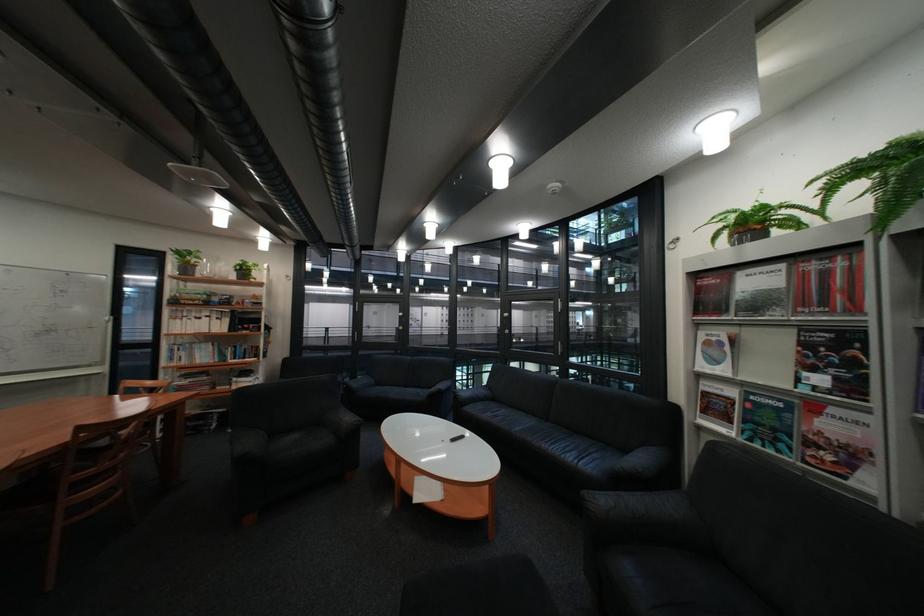
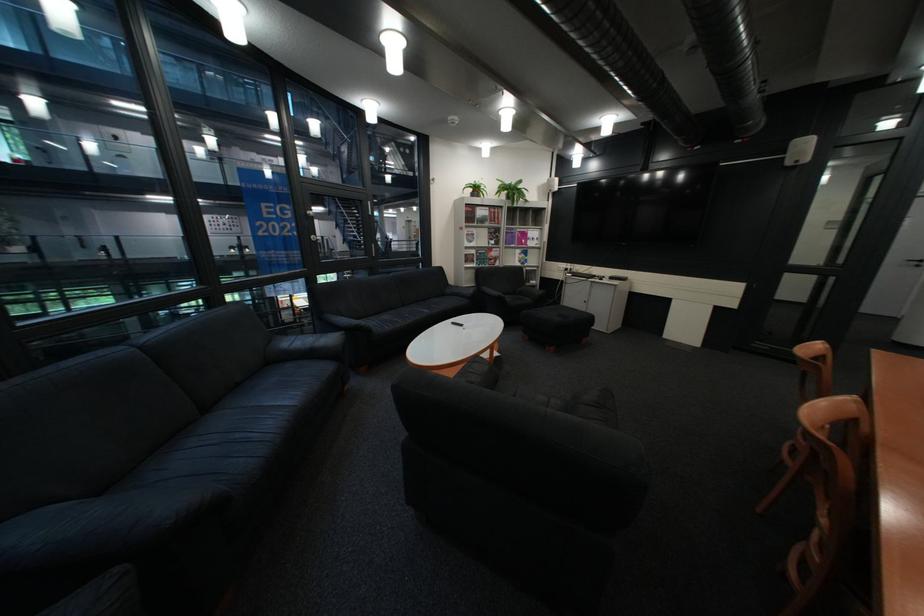
The point at (761,330) is marked in the first image. Where is the corresponding point in the second image?

(492, 229)